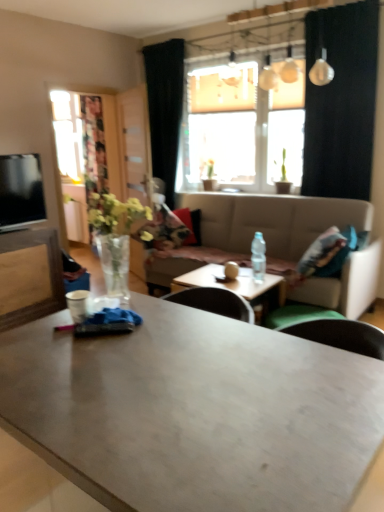
Where is `vacant space underneath matte black television at left (from a real-world perspective)`? This screenshot has height=512, width=384. vacant space underneath matte black television at left (from a real-world perspective) is located at coordinates point(21,228).